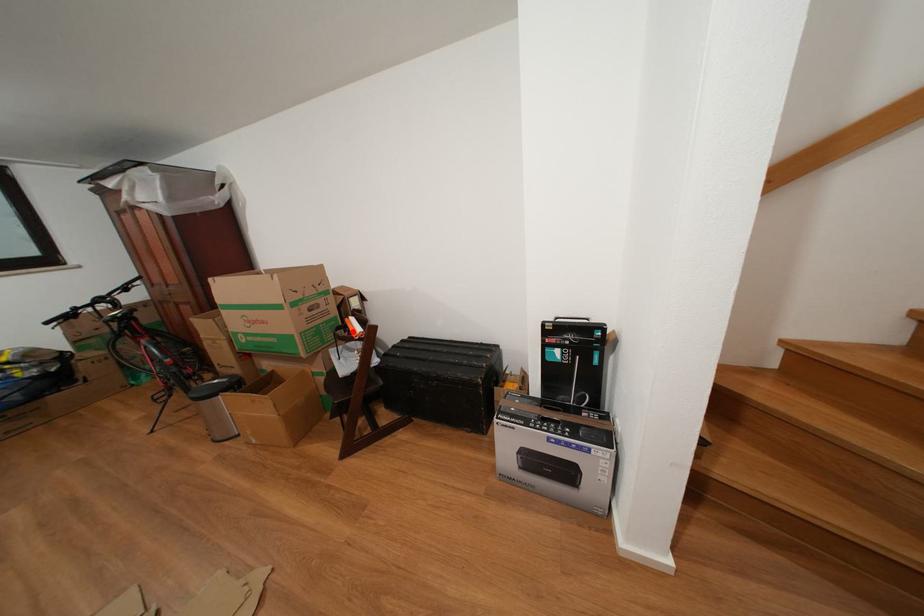
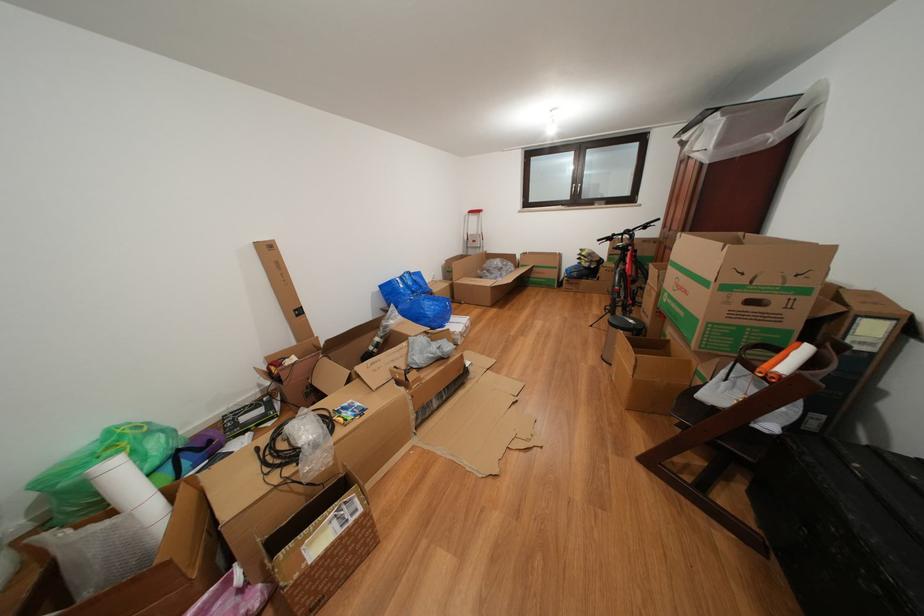
Where in the second image is the point corresponding to the highlighted location from the first image?

(784, 355)